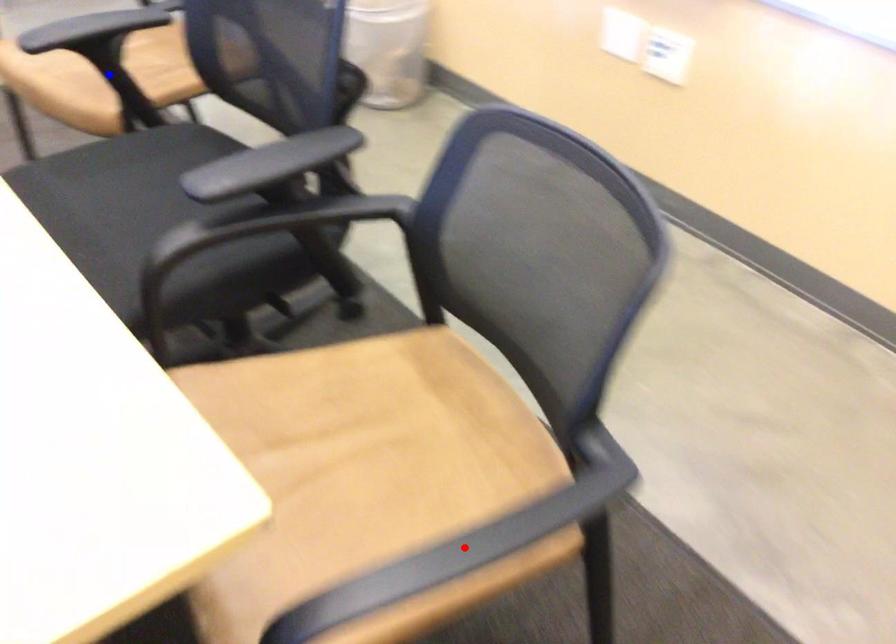
Question: Two points are marked on the image. Which point is closer to the camera?

Choices:
 (A) Blue point is closer.
 (B) Red point is closer.

Answer: (B)